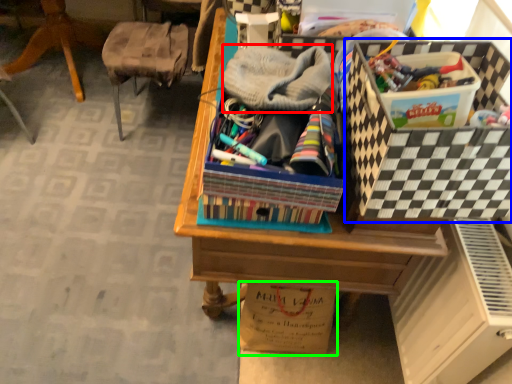
Question: Which is farther away from clothing (highlighted by a red box)? storage box (highlighted by a blue box) or cardboard box (highlighted by a green box)?

Choices:
 (A) storage box
 (B) cardboard box

Answer: (B)